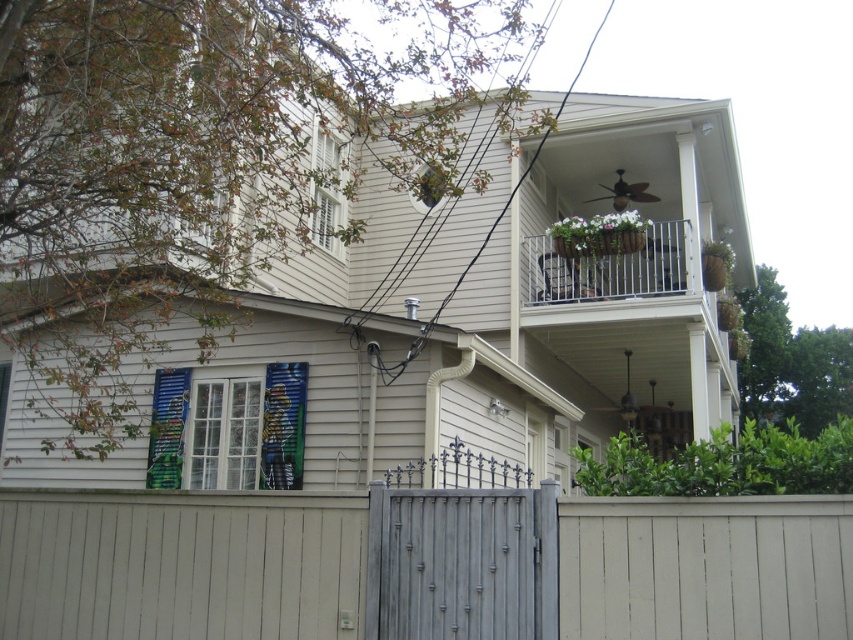
Question: Based on their relative distances, which object is farther from the painted wood shutter at lower left?

Choices:
 (A) white metal railing at upper center
 (B) green matte shutter at upper center

Answer: (A)

Question: Which point appears farthest from the camera in this image?

Choices:
 (A) (680, 244)
 (B) (326, 211)
 (C) (276, 460)

Answer: (B)

Question: Is the position of painted wood shutter at lower left more distant than that of green matte shutter at upper center?

Choices:
 (A) yes
 (B) no

Answer: (B)

Question: Can you confirm if painted wood shutter at lower left is bigger than white metal railing at upper center?

Choices:
 (A) no
 (B) yes

Answer: (A)

Question: Is white metal railing at upper center thinner than green matte shutter at upper center?

Choices:
 (A) no
 (B) yes

Answer: (A)

Question: Which of these objects is positioned farthest from the white metal railing at upper center?

Choices:
 (A) painted wood shutter at lower left
 (B) green matte shutter at upper center

Answer: (A)